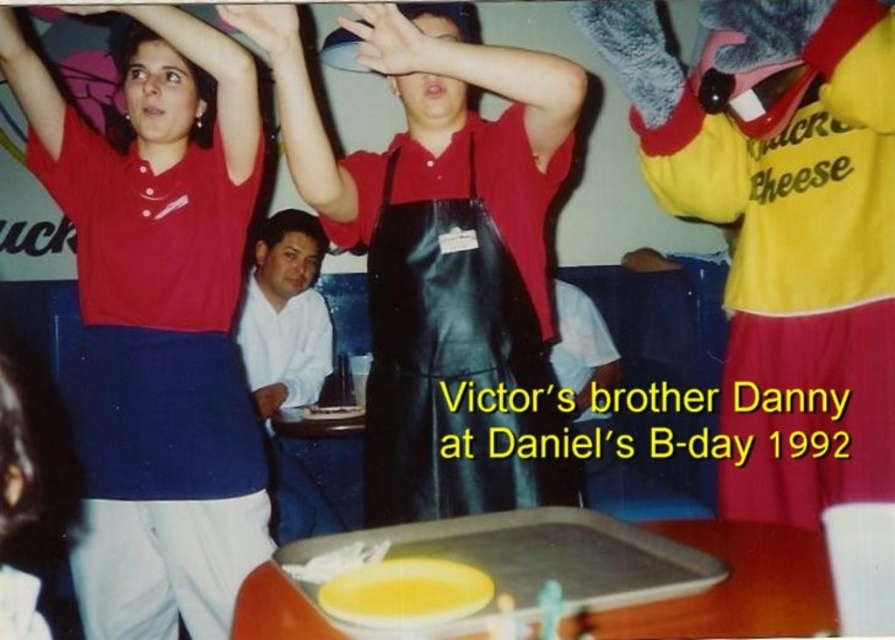
Who is more distant from viewer, (314, 388) or (295, 35)?

Positioned behind is point (314, 388).

Between white cotton shirt at lower left and matte skin hand at upper left, which one is positioned higher?

matte skin hand at upper left is higher up.

Does point (288, 522) come farther from viewer compared to point (288, 28)?

Yes.

I want to click on white cotton shirt at lower left, so click(288, 396).

Who is shorter, black leather apron at center or white cotton shirt at lower left?

With less height is black leather apron at center.

Describe the element at coordinates (450, 364) in the screenshot. I see `black leather apron at center` at that location.

Where is `black leather apron at center`? black leather apron at center is located at coordinates (450, 364).

Who is taller, white cotton shirt at lower left or matte black hand at upper center?

white cotton shirt at lower left is taller.

Can you confirm if white cotton shirt at lower left is wider than matte black hand at upper center?

Yes.

You are a GUI agent. You are given a task and a screenshot of the screen. Output one action in this format:
    pyautogui.click(x=<x>, y=<y>)
    Task: Click on the white cotton shirt at lower left
    
    Given the screenshot: What is the action you would take?
    pyautogui.click(x=288, y=396)

Find the location of a particular element. The width and height of the screenshot is (895, 640). white cotton shirt at lower left is located at coordinates (288, 396).